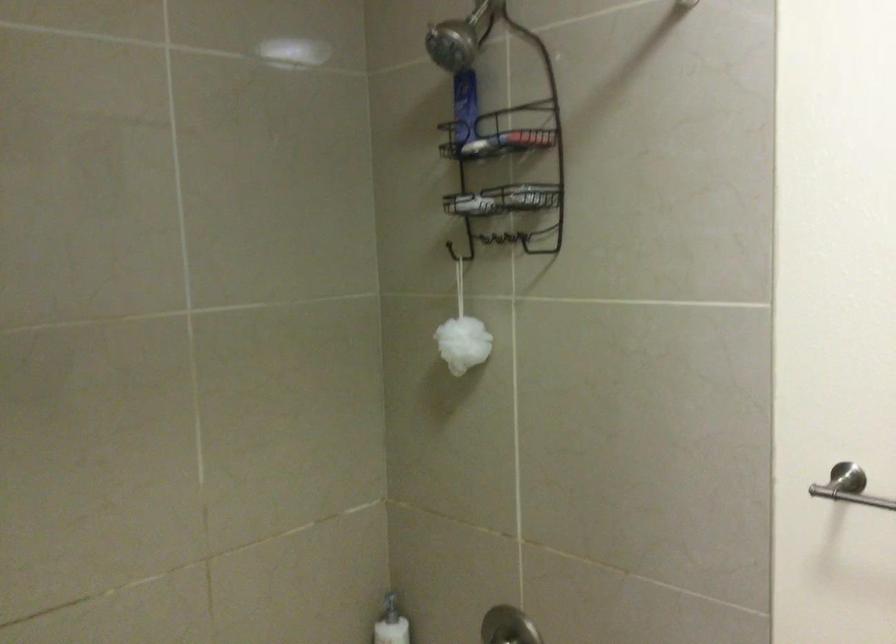
Which object does [460,37] point to?

This point indicates the silver shower head.